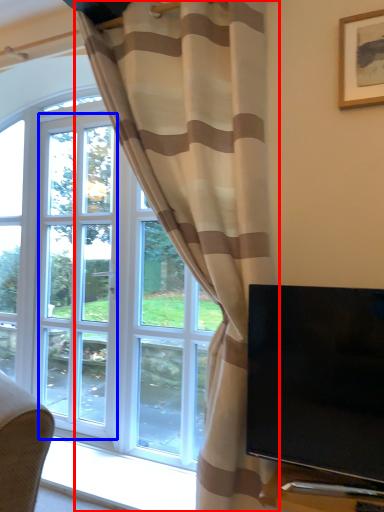
Question: Which object is further to the camera taking this photo, curtain (highlighted by a red box) or screen door (highlighted by a blue box)?

Choices:
 (A) curtain
 (B) screen door

Answer: (B)